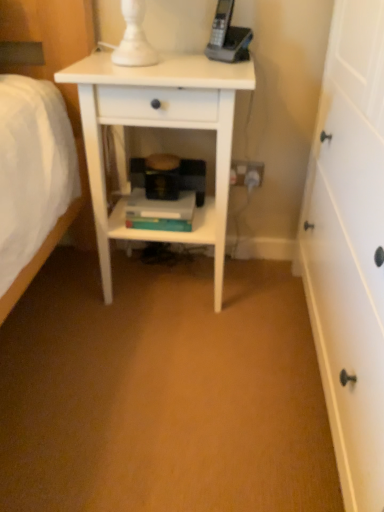
Where is `vacant area to the left of white matte nightstand at center`? vacant area to the left of white matte nightstand at center is located at coordinates (54, 301).